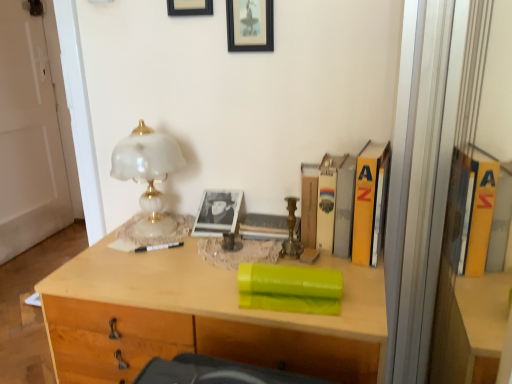
Question: Which direction should I rotate to face black matte picture frame at upper center, which is the first picture frame from left to right, — up or down?

Choices:
 (A) up
 (B) down

Answer: (A)

Question: From a real-world perspective, is white glossy door at left on yellow matte book at right?

Choices:
 (A) no
 (B) yes

Answer: (A)

Question: From the image's perspective, does white glossy door at left appear lower than yellow matte book at right?

Choices:
 (A) no
 (B) yes

Answer: (A)

Question: From a real-world perspective, is white glossy door at left physically below yellow matte book at right?

Choices:
 (A) yes
 (B) no

Answer: (A)

Question: Can you confirm if white glossy door at left is positioned to the left of yellow matte book at right?

Choices:
 (A) yes
 (B) no

Answer: (A)

Question: Are white glossy door at left and yellow matte book at right beside each other?

Choices:
 (A) yes
 (B) no

Answer: (B)

Question: Does white glossy door at left have a larger size compared to yellow matte book at right?

Choices:
 (A) no
 (B) yes

Answer: (B)

Question: Is black matte picture frame at upper center, which is the first picture frame from left to right, next to white glossy door at left?

Choices:
 (A) no
 (B) yes

Answer: (A)

Question: From the image's perspective, is black matte picture frame at upper center, placed as the second picture frame when sorted from right to left, located beneath white glossy door at left?

Choices:
 (A) no
 (B) yes

Answer: (A)

Question: Is black matte picture frame at upper center, placed as the second picture frame when sorted from right to left, bigger than white glossy door at left?

Choices:
 (A) yes
 (B) no

Answer: (B)

Question: Considering the relative sizes of black matte picture frame at upper center, placed as the second picture frame when sorted from right to left, and white glossy door at left in the image provided, is black matte picture frame at upper center, placed as the second picture frame when sorted from right to left, thinner than white glossy door at left?

Choices:
 (A) no
 (B) yes

Answer: (B)

Question: Does black matte picture frame at upper center, which is the first picture frame from left to right, come behind white glossy door at left?

Choices:
 (A) yes
 (B) no

Answer: (B)

Question: From a real-world perspective, is black matte picture frame at upper center, placed as the second picture frame when sorted from right to left, located beneath white glossy door at left?

Choices:
 (A) no
 (B) yes

Answer: (A)

Question: Could you tell me if black plastic pen at center is facing black framed picture at upper center, which appears as the 2th picture frame when viewed from the left?

Choices:
 (A) no
 (B) yes

Answer: (A)